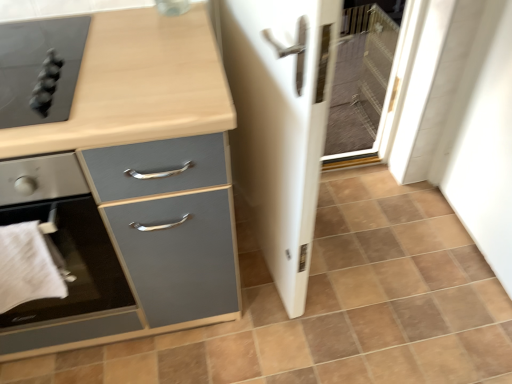
Question: Is white glossy screen door at center at the right side of matte black cooktop at upper left, acting as the 1th home appliance starting from the top?

Choices:
 (A) yes
 (B) no

Answer: (A)

Question: Does white glossy screen door at center turn towards matte black cooktop at upper left, acting as the 1th home appliance starting from the top?

Choices:
 (A) no
 (B) yes

Answer: (A)

Question: Is white glossy screen door at center wider than matte black cooktop at upper left, the second home appliance ordered from the bottom?

Choices:
 (A) yes
 (B) no

Answer: (B)

Question: Can you confirm if white glossy screen door at center is bigger than matte black cooktop at upper left, the second home appliance ordered from the bottom?

Choices:
 (A) no
 (B) yes

Answer: (B)

Question: Considering the relative sizes of white glossy screen door at center and matte black cooktop at upper left, the second home appliance ordered from the bottom, in the image provided, is white glossy screen door at center thinner than matte black cooktop at upper left, the second home appliance ordered from the bottom,?

Choices:
 (A) yes
 (B) no

Answer: (A)

Question: From a real-world perspective, is brown matte tile at center above or below matte black stove at left, which appears as the 2th home appliance when viewed from the top?

Choices:
 (A) above
 (B) below

Answer: (B)

Question: Which is correct: brown matte tile at center is inside matte black stove at left, which appears as the 2th home appliance when viewed from the top, or outside of it?

Choices:
 (A) inside
 (B) outside

Answer: (B)

Question: Does point (177, 332) appear closer or farther from the camera than point (39, 205)?

Choices:
 (A) farther
 (B) closer

Answer: (A)

Question: Is brown matte tile at center wider or thinner than matte black stove at left, which appears as the 2th home appliance when viewed from the top?

Choices:
 (A) wide
 (B) thin

Answer: (A)

Question: Considering the positions of point (58, 236) and point (4, 89), is point (58, 236) closer or farther from the camera than point (4, 89)?

Choices:
 (A) farther
 (B) closer

Answer: (A)

Question: From the image's perspective, is matte black stove at left, which appears as the 2th home appliance when viewed from the top, above or below matte black cooktop at upper left, the second home appliance ordered from the bottom?

Choices:
 (A) above
 (B) below

Answer: (B)

Question: From a real-world perspective, is matte black stove at left, which appears as the 2th home appliance when viewed from the top, above or below matte black cooktop at upper left, acting as the 1th home appliance starting from the top?

Choices:
 (A) below
 (B) above

Answer: (A)

Question: Considering the positions of matte black stove at left, which appears as the 2th home appliance when viewed from the top, and matte black cooktop at upper left, acting as the 1th home appliance starting from the top, in the image, is matte black stove at left, which appears as the 2th home appliance when viewed from the top, wider or thinner than matte black cooktop at upper left, acting as the 1th home appliance starting from the top,?

Choices:
 (A) wide
 (B) thin

Answer: (A)

Question: Considering their positions, is brown matte tile at center located in front of or behind white cloth at lower left?

Choices:
 (A) behind
 (B) front

Answer: (A)

Question: In terms of size, does brown matte tile at center appear bigger or smaller than white cloth at lower left?

Choices:
 (A) small
 (B) big

Answer: (B)